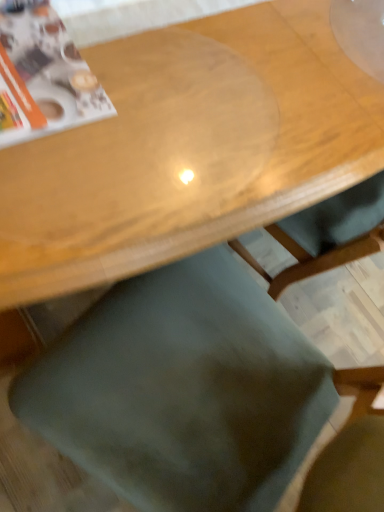
Question: Is matte paper magazine at upper left at the right side of transparent plastic table at upper center?

Choices:
 (A) yes
 (B) no

Answer: (B)

Question: Can you see matte paper magazine at upper left touching transparent plastic table at upper center?

Choices:
 (A) no
 (B) yes

Answer: (A)

Question: Is matte paper magazine at upper left facing away from transparent plastic table at upper center?

Choices:
 (A) no
 (B) yes

Answer: (B)

Question: Is matte paper magazine at upper left not inside transparent plastic table at upper center?

Choices:
 (A) yes
 (B) no

Answer: (B)

Question: From the image's perspective, is matte paper magazine at upper left under transparent plastic table at upper center?

Choices:
 (A) yes
 (B) no

Answer: (A)

Question: Based on their sizes in the image, would you say green fabric chair at lower center is bigger or smaller than matte paper magazine at upper left?

Choices:
 (A) small
 (B) big

Answer: (B)

Question: Does point (165, 434) appear closer or farther from the camera than point (23, 24)?

Choices:
 (A) farther
 (B) closer

Answer: (A)

Question: From their relative heights in the image, would you say green fabric chair at lower center is taller or shorter than matte paper magazine at upper left?

Choices:
 (A) tall
 (B) short

Answer: (A)

Question: From the image's perspective, relative to matte paper magazine at upper left, is green fabric chair at lower center above or below?

Choices:
 (A) below
 (B) above

Answer: (A)

Question: Considering the positions of green fabric chair at lower center and transparent plastic table at upper center in the image, is green fabric chair at lower center bigger or smaller than transparent plastic table at upper center?

Choices:
 (A) small
 (B) big

Answer: (A)

Question: Is green fabric chair at lower center inside or outside of transparent plastic table at upper center?

Choices:
 (A) inside
 (B) outside

Answer: (B)

Question: From the image's perspective, is green fabric chair at lower center located above or below transparent plastic table at upper center?

Choices:
 (A) below
 (B) above

Answer: (A)

Question: Considering their positions, is green fabric chair at lower center located in front of or behind transparent plastic table at upper center?

Choices:
 (A) behind
 (B) front

Answer: (B)

Question: Is point (276, 74) closer or farther from the camera than point (49, 9)?

Choices:
 (A) closer
 (B) farther

Answer: (B)

Question: Based on their positions, is transparent plastic table at upper center located to the left or right of matte paper magazine at upper left?

Choices:
 (A) right
 (B) left

Answer: (A)